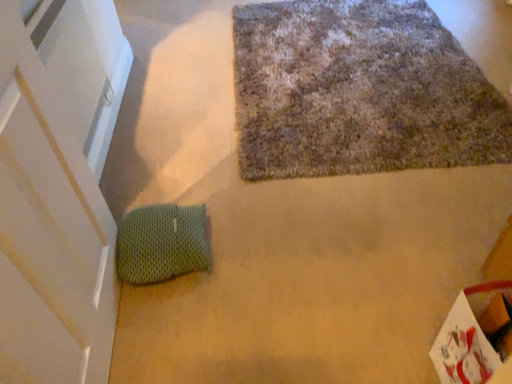
Identify the location of green knitted bean bag at lower left. Image resolution: width=512 pixels, height=384 pixels. (162, 243).

Describe the element at coordinates (162, 243) in the screenshot. I see `green knitted bean bag at lower left` at that location.

What do you see at coordinates (359, 91) in the screenshot? This screenshot has height=384, width=512. I see `textured woolen mat at upper center` at bounding box center [359, 91].

In order to face textured woolen mat at upper center, should I rotate leftwards or rightwards?

To align with it, rotate right about 12.207°.

Identify the location of textured woolen mat at upper center. This screenshot has height=384, width=512. (359, 91).

Find the location of `green knitted bean bag at lower left`. green knitted bean bag at lower left is located at coordinates (162, 243).

Can you confirm if green knitted bean bag at lower left is positioned to the right of textured woolen mat at upper center?

In fact, green knitted bean bag at lower left is to the left of textured woolen mat at upper center.

Is the position of green knitted bean bag at lower left more distant than that of textured woolen mat at upper center?

No, it is not.

Considering the positions of points (161, 212) and (426, 79), is point (161, 212) farther from camera compared to point (426, 79)?

No.

From the image's perspective, would you say green knitted bean bag at lower left is positioned over textured woolen mat at upper center?

No, from the image's perspective, green knitted bean bag at lower left is not above textured woolen mat at upper center.

From a real-world perspective, is green knitted bean bag at lower left physically located above or below textured woolen mat at upper center?

green knitted bean bag at lower left is above textured woolen mat at upper center.

Based on the photo, is green knitted bean bag at lower left wider than textured woolen mat at upper center?

Incorrect, the width of green knitted bean bag at lower left does not surpass that of textured woolen mat at upper center.

Is green knitted bean bag at lower left taller or shorter than textured woolen mat at upper center?

green knitted bean bag at lower left is taller than textured woolen mat at upper center.

Considering the sizes of objects green knitted bean bag at lower left and textured woolen mat at upper center in the image provided, who is smaller, green knitted bean bag at lower left or textured woolen mat at upper center?

Smaller between the two is green knitted bean bag at lower left.

Is green knitted bean bag at lower left situated inside textured woolen mat at upper center or outside?

green knitted bean bag at lower left lies outside textured woolen mat at upper center.

Is green knitted bean bag at lower left positioned far away from textured woolen mat at upper center?

Actually, green knitted bean bag at lower left and textured woolen mat at upper center are a little close together.

Based on the photo, is green knitted bean bag at lower left oriented away from textured woolen mat at upper center?

No, textured woolen mat at upper center is not at the back of green knitted bean bag at lower left.

How many degrees apart are the facing directions of green knitted bean bag at lower left and textured woolen mat at upper center?

The angle between the facing direction of green knitted bean bag at lower left and the facing direction of textured woolen mat at upper center is 96.5 degrees.

Measure the distance from green knitted bean bag at lower left to textured woolen mat at upper center.

green knitted bean bag at lower left and textured woolen mat at upper center are 33.37 inches apart from each other.

Locate an element on the screen. This screenshot has height=384, width=512. bean bag chair that is on the left side of textured woolen mat at upper center is located at coordinates (162, 243).

Considering the relative positions of textured woolen mat at upper center and green knitted bean bag at lower left in the image provided, is textured woolen mat at upper center to the left or to the right of green knitted bean bag at lower left?

textured woolen mat at upper center is positioned on green knitted bean bag at lower left's right side.

In the image, is textured woolen mat at upper center positioned in front of or behind green knitted bean bag at lower left?

In the image, textured woolen mat at upper center appears behind green knitted bean bag at lower left.

Considering the positions of point (250, 41) and point (131, 271), is point (250, 41) closer or farther from the camera than point (131, 271)?

Point (250, 41) is farther from the camera than point (131, 271).

From the image's perspective, is textured woolen mat at upper center on top of green knitted bean bag at lower left?

Yes, from the image's perspective, textured woolen mat at upper center is above green knitted bean bag at lower left.

From a real-world perspective, is textured woolen mat at upper center over green knitted bean bag at lower left?

Actually, textured woolen mat at upper center is physically below green knitted bean bag at lower left in the real world.

Looking at this image, between textured woolen mat at upper center and green knitted bean bag at lower left, which one has smaller width?

green knitted bean bag at lower left is thinner.

Which of these two, textured woolen mat at upper center or green knitted bean bag at lower left, stands shorter?

Standing shorter between the two is textured woolen mat at upper center.

In terms of size, does textured woolen mat at upper center appear bigger or smaller than green knitted bean bag at lower left?

textured woolen mat at upper center is bigger than green knitted bean bag at lower left.

Is textured woolen mat at upper center not inside green knitted bean bag at lower left?

Yes, textured woolen mat at upper center is outside of green knitted bean bag at lower left.

Is textured woolen mat at upper center beside green knitted bean bag at lower left?

textured woolen mat at upper center is not next to green knitted bean bag at lower left, and they're not touching.

Does textured woolen mat at upper center turn towards green knitted bean bag at lower left?

No, textured woolen mat at upper center is not turned towards green knitted bean bag at lower left.

What's the angular difference between textured woolen mat at upper center and green knitted bean bag at lower left's facing directions?

96.5 degrees.

This screenshot has width=512, height=384. Find the location of `mat beneath the green knitted bean bag at lower left (from a real-world perspective)`. mat beneath the green knitted bean bag at lower left (from a real-world perspective) is located at coordinates pos(359,91).

Where is `mat that appears above the green knitted bean bag at lower left (from the image's perspective)`? mat that appears above the green knitted bean bag at lower left (from the image's perspective) is located at coordinates (359, 91).

You are a GUI agent. You are given a task and a screenshot of the screen. Output one action in this format:
    pyautogui.click(x=<x>, y=<y>)
    Task: Click on the mat below the green knitted bean bag at lower left (from a real-world perspective)
    The height and width of the screenshot is (384, 512).
    Given the screenshot: What is the action you would take?
    pos(359,91)